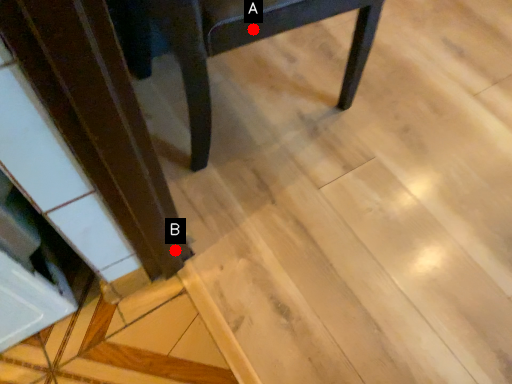
Question: Two points are circled on the image, labeled by A and B beside each circle. Which of the following is the closest to the observer?

Choices:
 (A) A is closer
 (B) B is closer

Answer: (A)